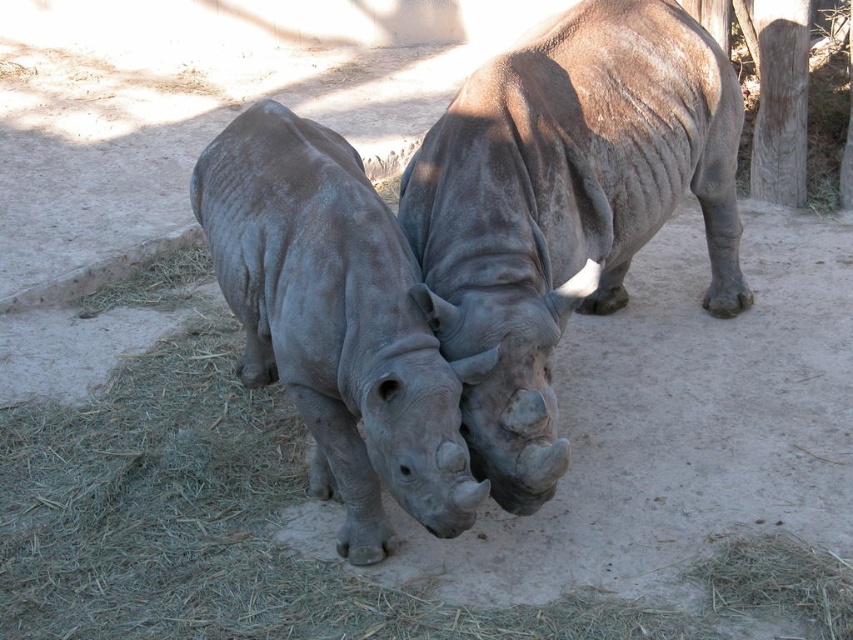
Can you confirm if gray textured rhino at center is wider than gray matte rhinoceros at center?

Correct, the width of gray textured rhino at center exceeds that of gray matte rhinoceros at center.

Which is in front, point (526, 173) or point (198, 168)?

Point (526, 173) is in front.

Does point (595, 77) come behind point (369, 436)?

Yes, point (595, 77) is farther from viewer.

Where is `gray textured rhino at center`? gray textured rhino at center is located at coordinates (566, 205).